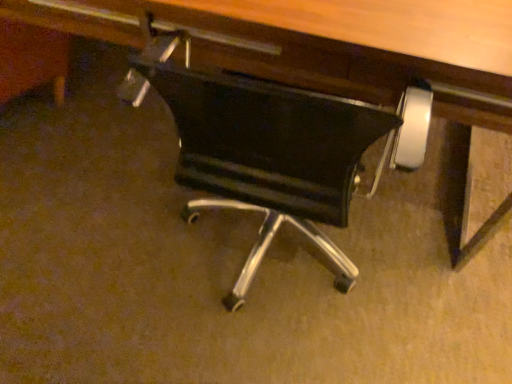
What do you see at coordinates (359, 46) in the screenshot?
I see `wooden desk at center` at bounding box center [359, 46].

Identify the location of wooden desk at center. This screenshot has height=384, width=512. (359, 46).

Find the location of `wooden desk at center`. wooden desk at center is located at coordinates (359, 46).